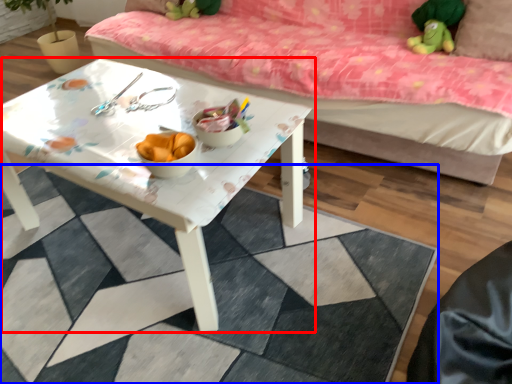
Question: Among these objects, which one is farthest to the camera, table (highlighted by a red box) or tile (highlighted by a blue box)?

Choices:
 (A) table
 (B) tile

Answer: (A)